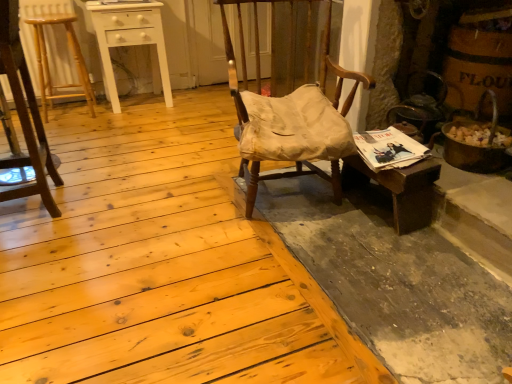
Locate an element on the screen. free space between wooden stool at left, which is the 2th chair in right-to-left order, and wooden desk at right is located at coordinates (174, 211).